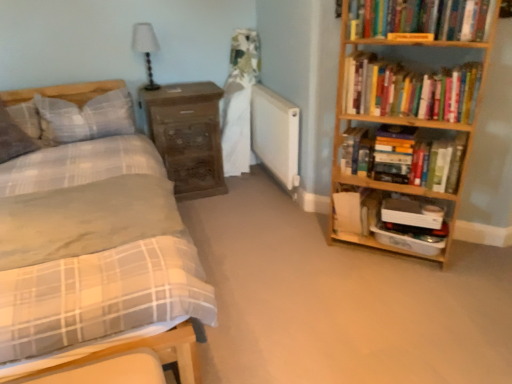
Identify the location of vacant area that lies between wooden carved chest of drawers at center and hardcover book at center right, marked as the 1th paperback book in a back-to-front arrangement. (259, 216).